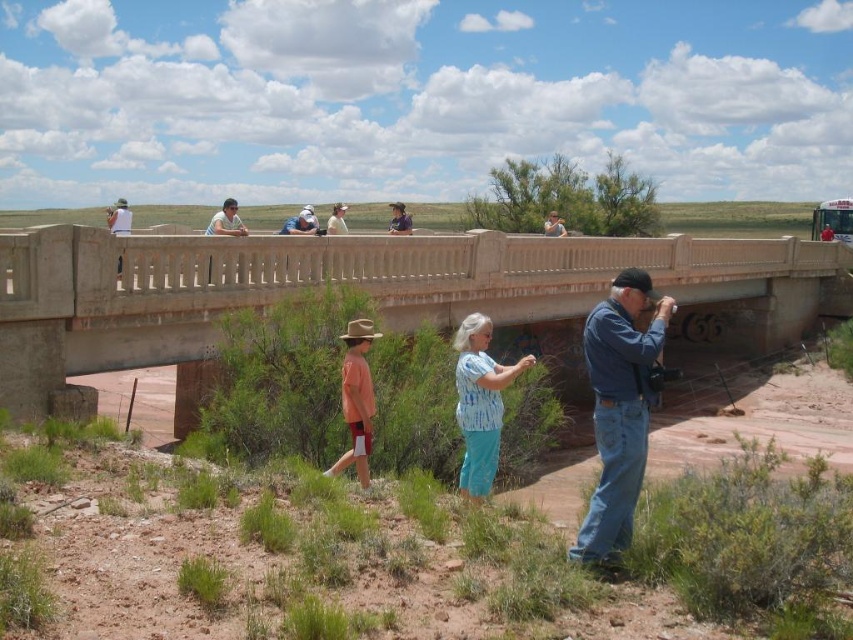
You are standing on the bridge and want to take a photo. There are two points marked on the bridge surface at coordinates point (631, 300) and point (489, 330). Which point is closer to your camera when you look straight ahead?

Point (631, 300) is closer to the camera than point (489, 330).

Consider the image. You are standing at the center of the bridge and want to find the blue denim jeans at lower right. In which direction should you look relative to your position?

The blue denim jeans at lower right are located at point (619, 410) in 2D space, so you should look to your lower right direction to find them.